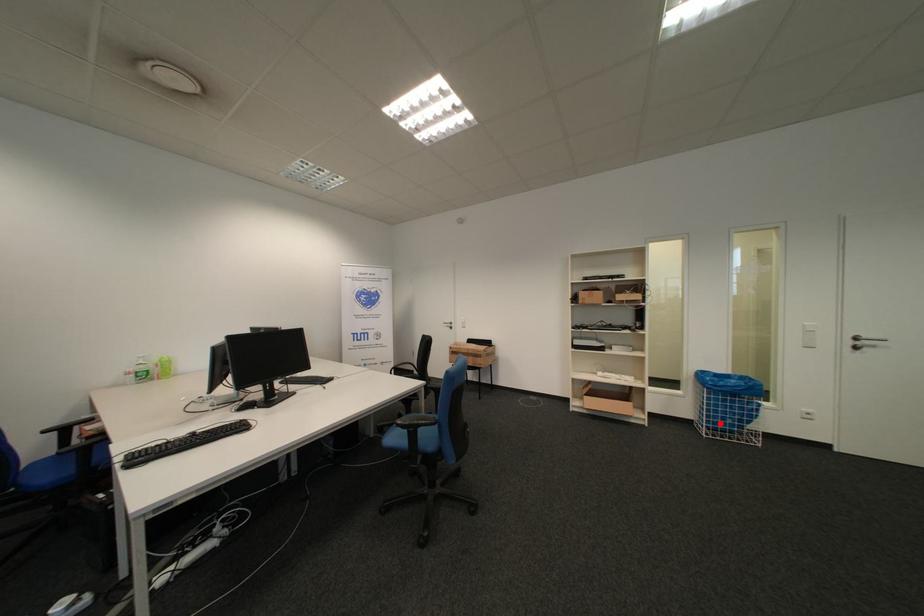
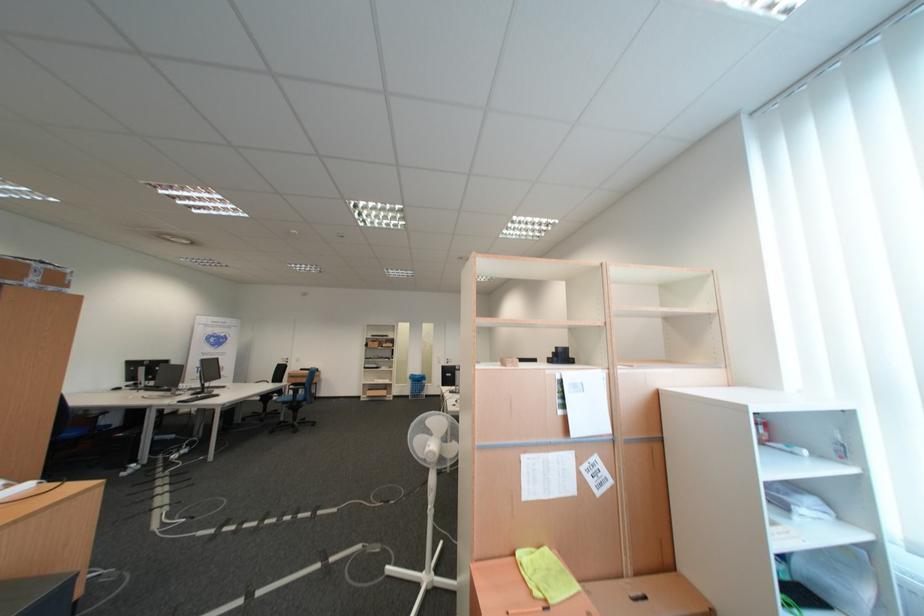
Locate, in the second image, the point that corresponds to the highlighted location in the first image.

(422, 394)